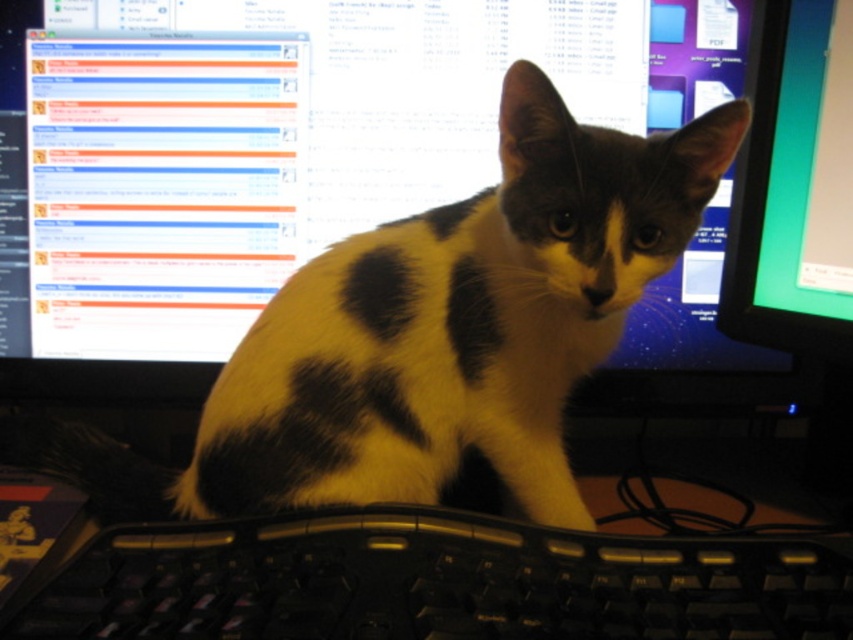
You are trying to access the computer screen but there is a black and white fur cat at center in the way. Can you estimate the cat position in the image using coordinates?

The black and white fur cat at center is located at coordinates point (457, 323).

From the picture: You are setting up a workstation and need to ensure there is enough vertical space between the black and white fur cat at center and the black plastic keyboard at center for a monitor stand. Can the stand be placed between them?

The black and white fur cat at center is taller than the black plastic keyboard at center, so placing a monitor stand between them would require considering the cat as the taller object. However, since the cat is an animal and not a fixed object, it might move, making the placement uncertain. The vertical space between them depends on the cat remaining still, which isn